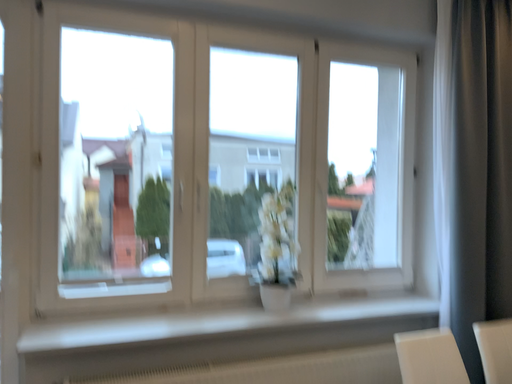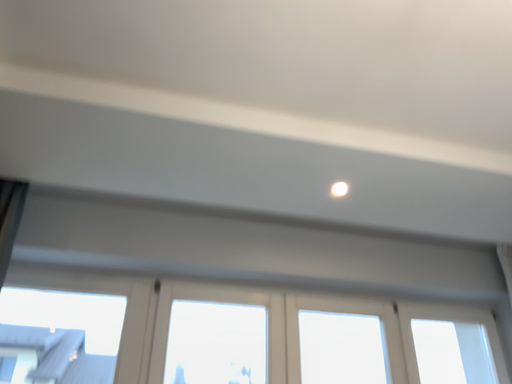
Question: How did the camera likely rotate when shooting the video?

Choices:
 (A) rotated upward
 (B) rotated downward

Answer: (A)